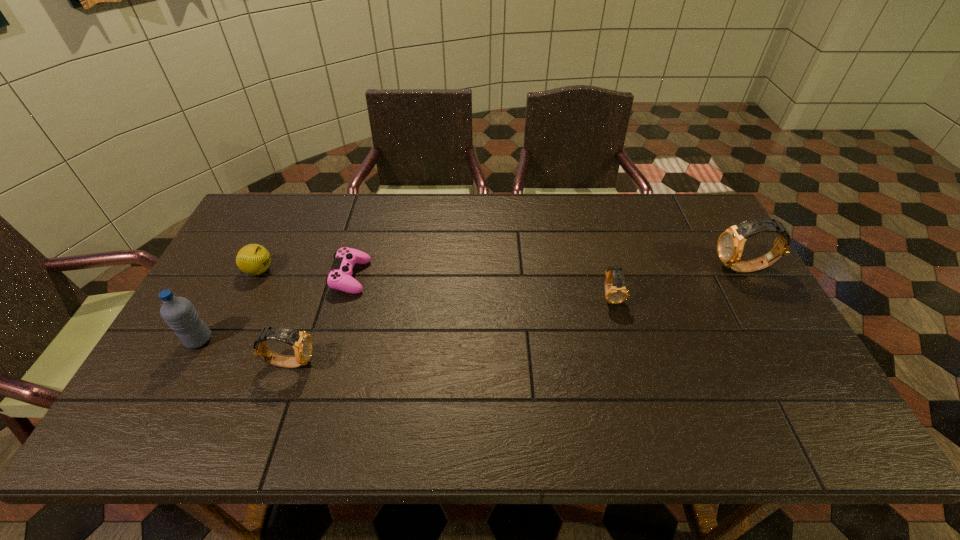
Locate an element on the screen. the third tallest object is located at coordinates (301, 342).

In order to click on the leftmost watch in this screenshot , I will do `click(301, 342)`.

Locate an element on the screen. This screenshot has height=540, width=960. the second nearest watch is located at coordinates (616, 293).

Where is `the fifth object from left to right`? This screenshot has height=540, width=960. the fifth object from left to right is located at coordinates (616, 293).

At what (x,y) coordinates should I click in order to perform the action: click on the farthest watch. Please return your answer as a coordinate pair (x, y). The height and width of the screenshot is (540, 960). Looking at the image, I should click on tap(730, 245).

I want to click on the rightmost object, so click(730, 245).

This screenshot has height=540, width=960. Find the location of `control`. control is located at coordinates (339, 278).

Locate an element on the screen. The height and width of the screenshot is (540, 960). softball is located at coordinates (253, 259).

You are a GUI agent. You are given a task and a screenshot of the screen. Output one action in this format:
    pyautogui.click(x=<x>, y=<y>)
    Task: Click on the water bottle
    This screenshot has height=540, width=960.
    Given the screenshot: What is the action you would take?
    [179, 313]

The image size is (960, 540). What are the coordinates of `free spot located 0.290m on the face of the second shortest watch` in the screenshot? It's located at (430, 362).